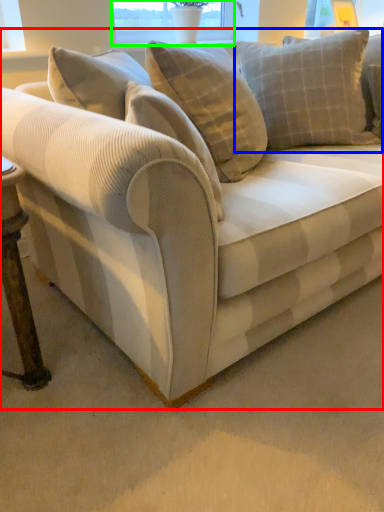
Question: Which is nearer to the studio couch (highlighted by a red box)? pillow (highlighted by a blue box) or window screen (highlighted by a green box).

Choices:
 (A) pillow
 (B) window screen

Answer: (A)